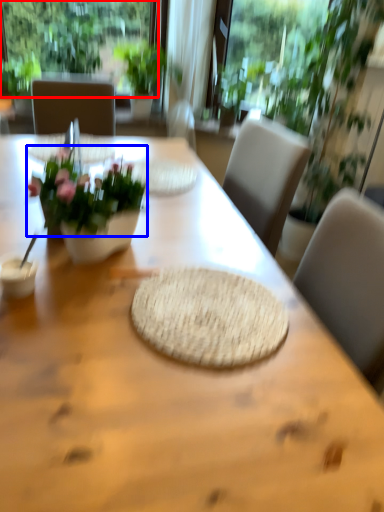
Question: Which object appears closest to the camera in this image, window (highlighted by a red box) or flower (highlighted by a blue box)?

Choices:
 (A) window
 (B) flower

Answer: (B)